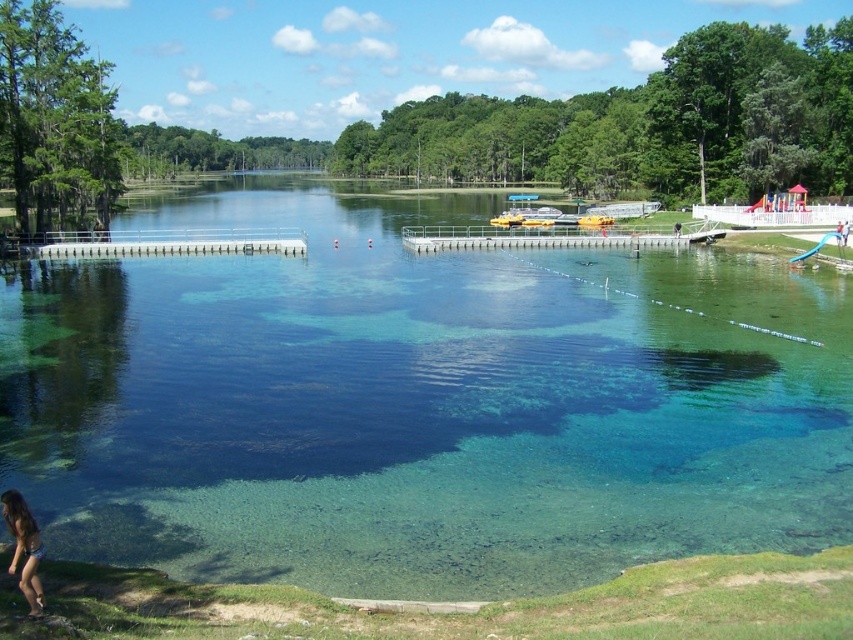
Question: Does blue bikini at lower left appear on the left side of brown leather jacket at lower center?

Choices:
 (A) no
 (B) yes

Answer: (B)

Question: Which of these objects is positioned farthest from the metallic gray dock at center?

Choices:
 (A) white plastic dock at center
 (B) blue bikini at lower left
 (C) brown leather jacket at lower center

Answer: (B)

Question: Which point appears farthest from the camera in this image?

Choices:
 (A) (762, 344)
 (B) (677, 230)
 (C) (271, 244)
 (D) (488, 240)

Answer: (D)

Question: Considering the relative positions of metallic gray dock at center and white plastic dock at center in the image provided, where is metallic gray dock at center located with respect to white plastic dock at center?

Choices:
 (A) left
 (B) right

Answer: (B)

Question: Can you confirm if metallic gray dock at center is positioned above blue bikini at lower left?

Choices:
 (A) no
 (B) yes

Answer: (B)

Question: Which of the following is the farthest from the observer?

Choices:
 (A) (15, 564)
 (B) (676, 234)
 (C) (152, 538)
 (D) (291, 237)

Answer: (D)